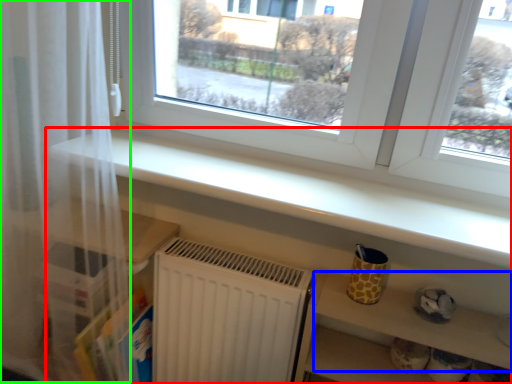
Question: Considering the real-world distances, which object is farthest from shelf (highlighted by a red box)? shelf (highlighted by a blue box) or curtain (highlighted by a green box)?

Choices:
 (A) shelf
 (B) curtain

Answer: (B)